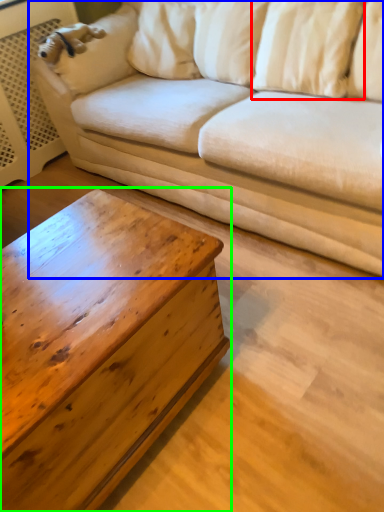
Question: Based on their relative distances, which object is nearer to pillow (highlighted by a red box)? Choose from studio couch (highlighted by a blue box) and coffee table (highlighted by a green box).

Choices:
 (A) studio couch
 (B) coffee table

Answer: (A)